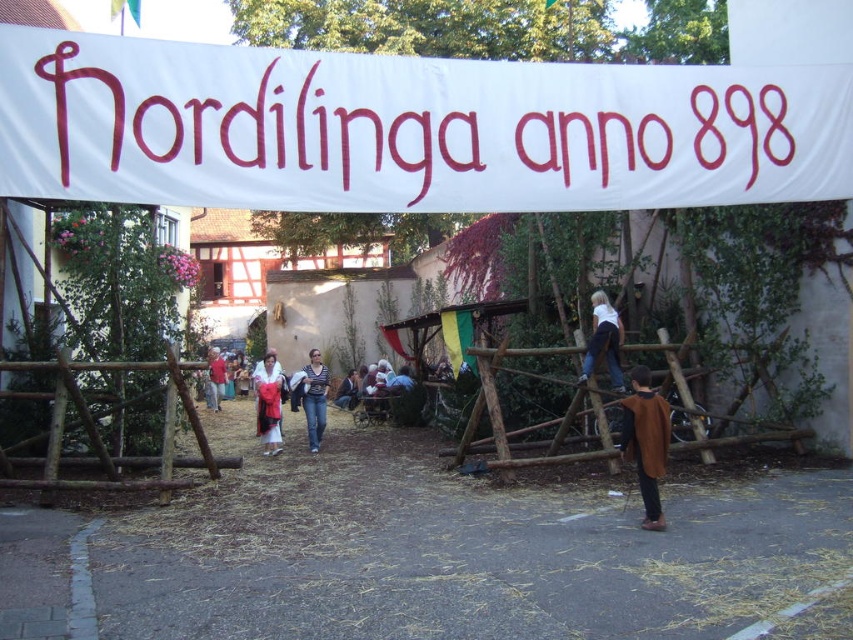
Is white fabric banner at upper center below brown woolen cape at center?

No, white fabric banner at upper center is not below brown woolen cape at center.

Is point (381, 184) less distant than point (633, 426)?

No.

The image size is (853, 640). I want to click on white fabric banner at upper center, so click(407, 129).

Which is more to the right, white fabric banner at upper center or denim jacket at center?

white fabric banner at upper center

Which is in front, point (44, 80) or point (351, 387)?

Point (44, 80)

Identify the location of white fabric banner at upper center. (407, 129).

Is matte red dress at center to the right of denim jacket at center from the viewer's perspective?

Incorrect, matte red dress at center is not on the right side of denim jacket at center.

Is matte red dress at center bigger than denim jacket at center?

Incorrect, matte red dress at center is not larger than denim jacket at center.

Where is `matte red dress at center`? matte red dress at center is located at coordinates (268, 403).